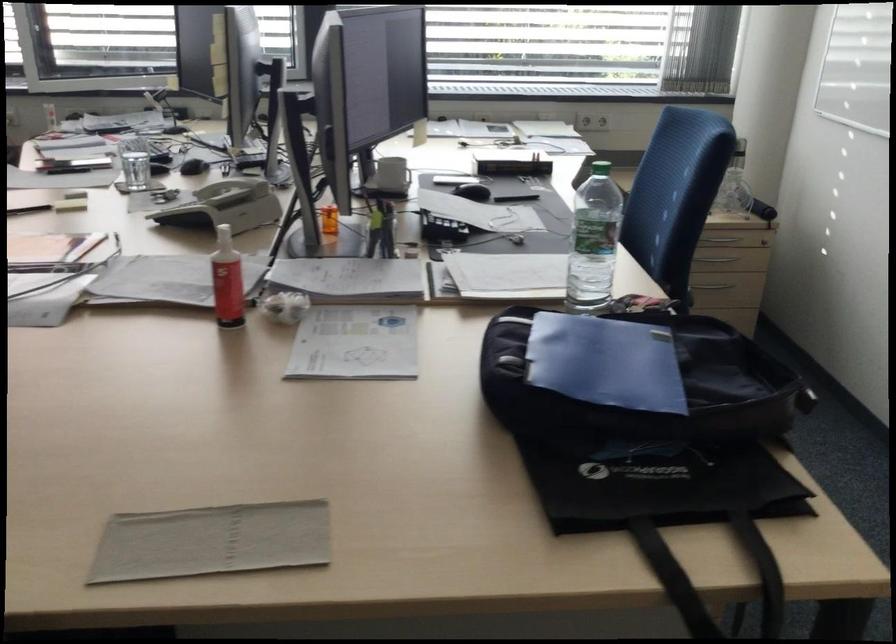
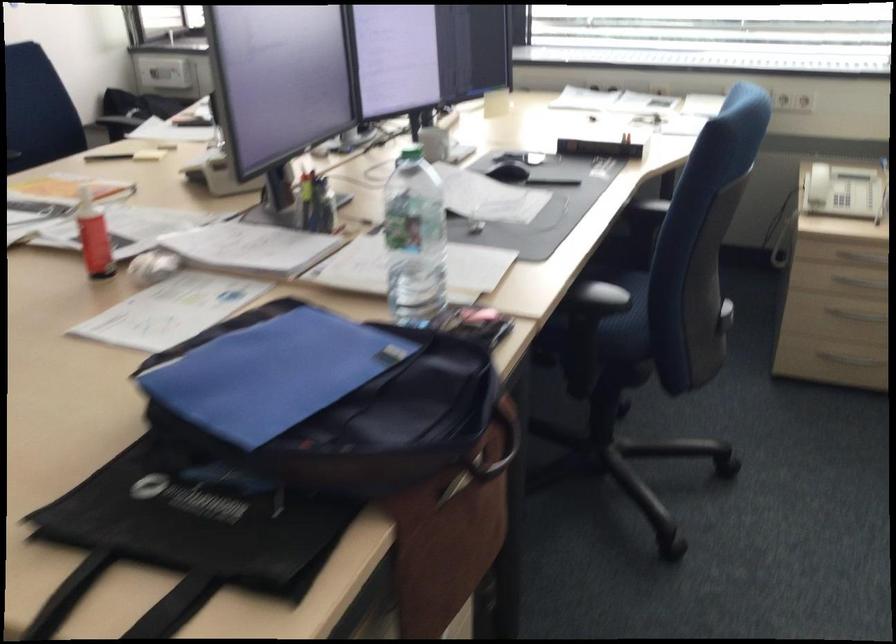
In a continuous first-person perspective shot, in which direction is the camera moving?

The movement direction of the cameraman is right, forward.